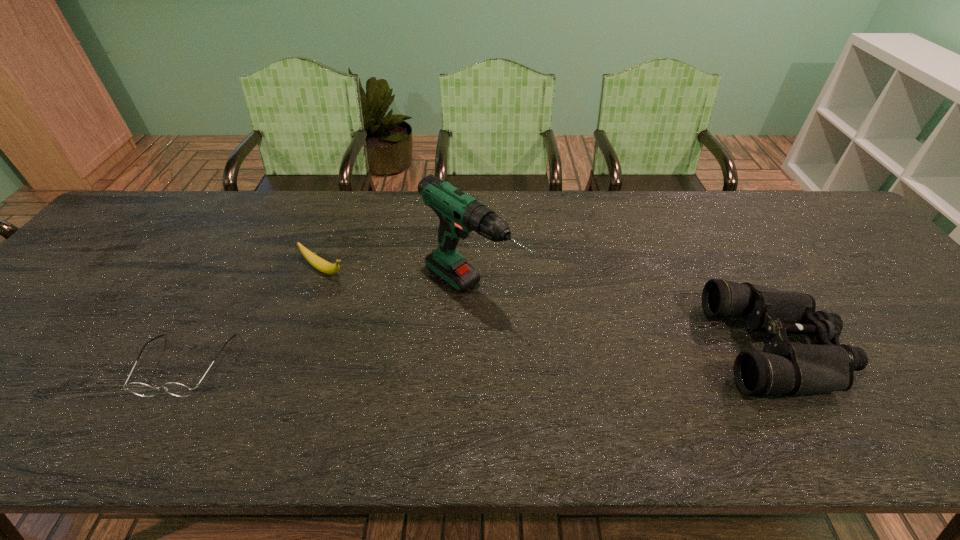
What are the coordinates of `vacant space located 0.340m at the stem of the banana` in the screenshot? It's located at (445, 338).

Identify the location of free region located on the handle side of the second object from right to left. (566, 364).

In order to click on free point located 0.150m on the handle side of the second object from right to left in this screenshot , I will do `click(556, 356)`.

This screenshot has height=540, width=960. Find the location of `free space located 0.180m on the handle side of the second object from right to left`. free space located 0.180m on the handle side of the second object from right to left is located at coordinates (566, 364).

Where is `spectacles positioned at the near edge`? spectacles positioned at the near edge is located at coordinates (141, 389).

Where is `binoculars located at the near edge`? The width and height of the screenshot is (960, 540). binoculars located at the near edge is located at coordinates click(783, 367).

I want to click on vacant space at the far edge of the desktop, so click(x=215, y=195).

At what (x,y) coordinates should I click in order to perform the action: click on vacant space at the near edge. Please return your answer as a coordinate pair (x, y). The height and width of the screenshot is (540, 960). Looking at the image, I should click on 375,380.

Find the location of `vacant space at the left edge of the desktop`. vacant space at the left edge of the desktop is located at coordinates (1, 346).

The image size is (960, 540). In the image, there is a desktop. What are the coordinates of `vacant space at the right edge` in the screenshot? It's located at (863, 257).